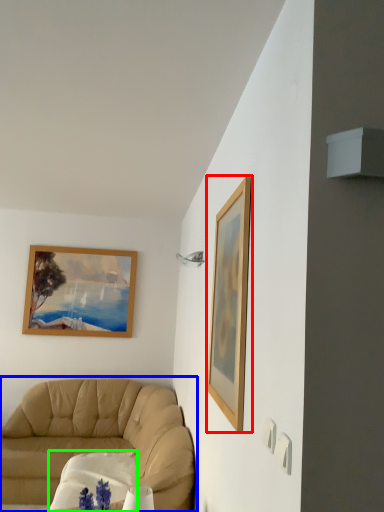
Question: Which object is positioned farthest from picture frame (highlighted by a red box)? Select from studio couch (highlighted by a blue box) and round table (highlighted by a green box).

Choices:
 (A) studio couch
 (B) round table

Answer: (A)